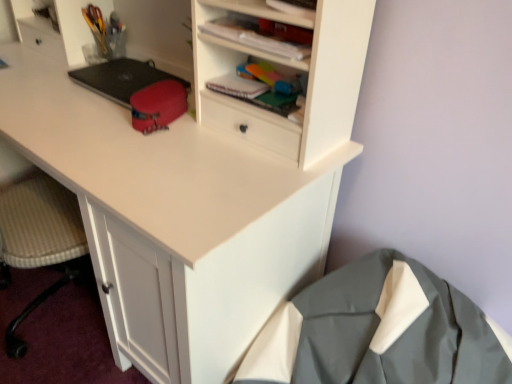
What do you see at coordinates (122, 78) in the screenshot? I see `black matte laptop at left` at bounding box center [122, 78].

Image resolution: width=512 pixels, height=384 pixels. What are the coordinates of `gray fabric coat at lower right` in the screenshot? It's located at (379, 331).

This screenshot has height=384, width=512. What do you see at coordinates (245, 8) in the screenshot? I see `matte white cabinet at upper center` at bounding box center [245, 8].

Describe the element at coordinates (106, 32) in the screenshot. I see `translucent plastic container at upper left, placed as the first stationery when sorted from left to right` at that location.

Image resolution: width=512 pixels, height=384 pixels. I want to click on black matte laptop at left, so click(122, 78).

From their relative heights in the image, would you say matte white cabinet at upper center is taller or shorter than translucent plastic container at upper left, which is counted as the 2th stationery, starting from the bottom?

Considering their sizes, matte white cabinet at upper center has less height than translucent plastic container at upper left, which is counted as the 2th stationery, starting from the bottom.

Which is more to the right, matte white cabinet at upper center or translucent plastic container at upper left, which appears as the 1th stationery when viewed from the back?

matte white cabinet at upper center.

Does matte white cabinet at upper center turn towards translucent plastic container at upper left, the 1th stationery from the top?

No, matte white cabinet at upper center does not turn towards translucent plastic container at upper left, the 1th stationery from the top.

From the image's perspective, which is above, gray fabric coat at lower right or matte red pouch at center, the 2th stationery when ordered from top to bottom?

matte red pouch at center, the 2th stationery when ordered from top to bottom, from the image's perspective.

Can you confirm if gray fabric coat at lower right is taller than matte red pouch at center, acting as the first stationery starting from the bottom?

Yes, gray fabric coat at lower right is taller than matte red pouch at center, acting as the first stationery starting from the bottom.

Which object is thinner, gray fabric coat at lower right or matte red pouch at center, which ranks as the first stationery in front-to-back order?

matte red pouch at center, which ranks as the first stationery in front-to-back order.

Which is behind, point (168, 106) or point (106, 47)?

The point (106, 47) is more distant.

From the picture: From the image's perspective, which one is positioned lower, matte red pouch at center, which ranks as the first stationery in front-to-back order, or translucent plastic container at upper left, the second stationery from the front?

matte red pouch at center, which ranks as the first stationery in front-to-back order, from the image's perspective.

Can you confirm if matte red pouch at center, which is the 2th stationery in left-to-right order, is thinner than translucent plastic container at upper left, placed as the first stationery when sorted from left to right?

No.

Based on the photo, considering the relative sizes of matte red pouch at center, which is the 2th stationery in left-to-right order, and gray fabric coat at lower right in the image provided, is matte red pouch at center, which is the 2th stationery in left-to-right order, bigger than gray fabric coat at lower right?

Actually, matte red pouch at center, which is the 2th stationery in left-to-right order, might be smaller than gray fabric coat at lower right.

Considering the positions of point (177, 111) and point (495, 358), is point (177, 111) closer or farther from the camera than point (495, 358)?

Point (177, 111) is positioned farther from the camera compared to point (495, 358).

Is gray fabric coat at lower right at the back of matte red pouch at center, which is counted as the second stationery, starting from the back?

That's not correct — matte red pouch at center, which is counted as the second stationery, starting from the back, is not looking away from gray fabric coat at lower right.

From a real-world perspective, is matte white cabinet at upper center positioned above or below gray fabric coat at lower right?

Clearly, from a real-world perspective, matte white cabinet at upper center is above gray fabric coat at lower right.

Considering the points (288, 20) and (431, 350), which point is behind, point (288, 20) or point (431, 350)?

Point (431, 350)

Considering the relative sizes of matte white cabinet at upper center and gray fabric coat at lower right in the image provided, is matte white cabinet at upper center wider than gray fabric coat at lower right?

In fact, matte white cabinet at upper center might be narrower than gray fabric coat at lower right.

Does gray fabric coat at lower right have a greater height compared to matte white cabinet at upper center?

Yes, gray fabric coat at lower right is taller than matte white cabinet at upper center.

Would you say gray fabric coat at lower right is inside or outside matte white cabinet at upper center?

gray fabric coat at lower right cannot be found inside matte white cabinet at upper center.

Is gray fabric coat at lower right facing away from matte white cabinet at upper center?

No, gray fabric coat at lower right's orientation is not away from matte white cabinet at upper center.

From the image's perspective, is gray fabric coat at lower right located above or below matte white cabinet at upper center?

gray fabric coat at lower right is situated lower than matte white cabinet at upper center in the image.

From their relative heights in the image, would you say black matte laptop at left is taller or shorter than matte white cabinet at upper center?

In the image, black matte laptop at left appears to be taller than matte white cabinet at upper center.

Where is `laptop located underneath the matte white cabinet at upper center (from a real-world perspective)`? laptop located underneath the matte white cabinet at upper center (from a real-world perspective) is located at coordinates (122, 78).

Which is more to the right, black matte laptop at left or matte white cabinet at upper center?

matte white cabinet at upper center is more to the right.

Can you tell me how much black matte laptop at left and matte white cabinet at upper center differ in facing direction?

black matte laptop at left and matte white cabinet at upper center are facing 1.17 degrees away from each other.

Where is `cabinet lying in front of the translucent plastic container at upper left, the second stationery from the front`? The height and width of the screenshot is (384, 512). cabinet lying in front of the translucent plastic container at upper left, the second stationery from the front is located at coordinates (245, 8).

Find the location of a particular element. the 1st stationery above the gray fabric coat at lower right (from the image's perspective) is located at coordinates (158, 105).

From the image, which object appears to be nearer to translucent plastic container at upper left, which is counted as the 2th stationery, starting from the bottom, matte red pouch at center, which is the 2th stationery in left-to-right order, or gray fabric coat at lower right?

The object closer to translucent plastic container at upper left, which is counted as the 2th stationery, starting from the bottom, is matte red pouch at center, which is the 2th stationery in left-to-right order.

Based on their spatial positions, is translucent plastic container at upper left, the second stationery when ordered from right to left, or black matte laptop at left closer to matte red pouch at center, which ranks as the first stationery in right-to-left order?

black matte laptop at left is positioned closer to the anchor matte red pouch at center, which ranks as the first stationery in right-to-left order.

Considering their positions, is matte white cabinet at upper center positioned closer to translucent plastic container at upper left, placed as the first stationery when sorted from left to right, than matte red pouch at center, which ranks as the first stationery in right-to-left order?

Based on the image, matte red pouch at center, which ranks as the first stationery in right-to-left order, appears to be nearer to translucent plastic container at upper left, placed as the first stationery when sorted from left to right.

When comparing their distances from gray fabric coat at lower right, does matte white cabinet at upper center or matte red pouch at center, which ranks as the first stationery in right-to-left order, seem further?

Based on the image, matte red pouch at center, which ranks as the first stationery in right-to-left order, appears to be further to gray fabric coat at lower right.

Which object lies nearer to the anchor point translucent plastic container at upper left, which appears as the 1th stationery when viewed from the back, gray fabric coat at lower right or matte white cabinet at upper center?

Among the two, matte white cabinet at upper center is located nearer to translucent plastic container at upper left, which appears as the 1th stationery when viewed from the back.

When comparing their distances from gray fabric coat at lower right, does matte red pouch at center, which is the 2th stationery in left-to-right order, or translucent plastic container at upper left, the 1th stationery from the top, seem further?

translucent plastic container at upper left, the 1th stationery from the top, lies further to gray fabric coat at lower right than the other object.

Which object lies nearer to the anchor point black matte laptop at left, gray fabric coat at lower right or translucent plastic container at upper left, which appears as the 1th stationery when viewed from the back?

Among the two, translucent plastic container at upper left, which appears as the 1th stationery when viewed from the back, is located nearer to black matte laptop at left.

When comparing their distances from gray fabric coat at lower right, does black matte laptop at left or translucent plastic container at upper left, the second stationery from the front, seem further?

translucent plastic container at upper left, the second stationery from the front, is further to gray fabric coat at lower right.

Image resolution: width=512 pixels, height=384 pixels. What are the coordinates of `laptop situated between translucent plastic container at upper left, the second stationery from the front, and matte white cabinet at upper center from left to right` in the screenshot? It's located at (122, 78).

In order to click on stationery between matte white cabinet at upper center and translucent plastic container at upper left, the second stationery when ordered from right to left, along the z-axis in this screenshot , I will do `click(158, 105)`.

The image size is (512, 384). What are the coordinates of `laptop between matte white cabinet at upper center and gray fabric coat at lower right vertically` in the screenshot? It's located at (122, 78).

The width and height of the screenshot is (512, 384). In order to click on cabinet that lies between translucent plastic container at upper left, which is counted as the 2th stationery, starting from the bottom, and gray fabric coat at lower right from top to bottom in this screenshot , I will do `click(245, 8)`.